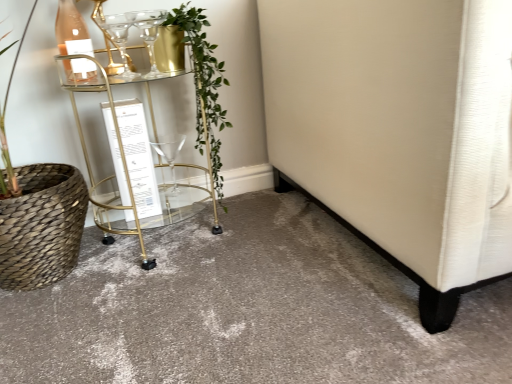
Question: Is green leafy plant at center in front of or behind clear glass wine glass at upper left, the first wine glass in the front-to-back sequence, in the image?

Choices:
 (A) front
 (B) behind

Answer: (A)

Question: Do you think green leafy plant at center is within clear glass wine glass at upper left, the first wine glass in the front-to-back sequence, or outside of it?

Choices:
 (A) inside
 (B) outside

Answer: (B)

Question: Estimate the real-world distances between objects in this image. Which object is farther from the clear glass wine glass at upper left, the 1th wine glass when ordered from top to bottom?

Choices:
 (A) carpeted floor at center
 (B) matte glass bottle at upper left
 (C) gold metallic bar cart at center
 (D) clear glass wine glass at center, acting as the 2th wine glass starting from the front
 (E) green leafy plant at center

Answer: (A)

Question: Based on their relative distances, which object is farther from the green leafy plant at center?

Choices:
 (A) matte glass bottle at upper left
 (B) clear glass wine glass at center, the 1th wine glass viewed from the back
 (C) gold metallic bar cart at center
 (D) clear glass wine glass at upper left, the first wine glass in the front-to-back sequence
 (E) carpeted floor at center

Answer: (E)